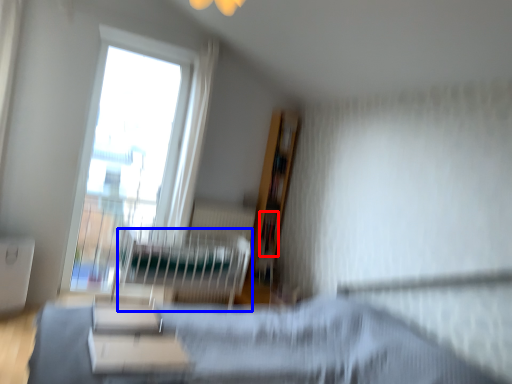
Question: Which object is closer to the camera taking this photo, book (highlighted by a red box) or hospital bed (highlighted by a blue box)?

Choices:
 (A) book
 (B) hospital bed

Answer: (B)